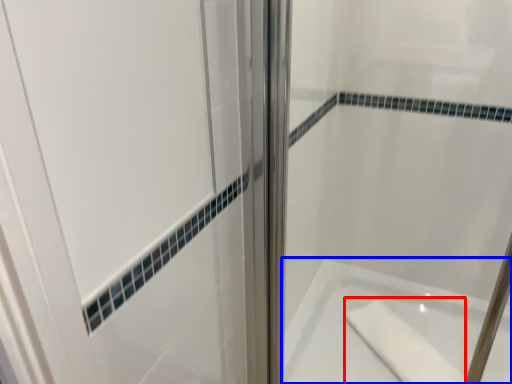
Question: Among these objects, which one is nearest to the camera, soap (highlighted by a red box) or bathtub (highlighted by a blue box)?

Choices:
 (A) soap
 (B) bathtub

Answer: (B)